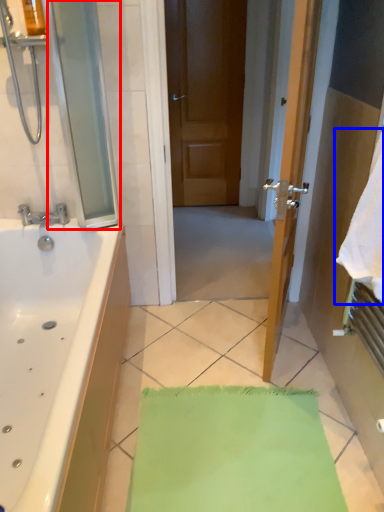
Question: Which object appears closest to the camera in this image, screen door (highlighted by a red box) or beach towel (highlighted by a blue box)?

Choices:
 (A) screen door
 (B) beach towel

Answer: (B)